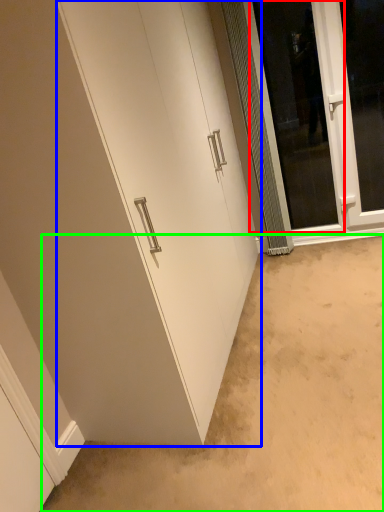
Question: Based on their relative distances, which object is farther from screen door (highlighted by a red box)? Choose from door (highlighted by a blue box) and plain (highlighted by a green box).

Choices:
 (A) door
 (B) plain

Answer: (B)